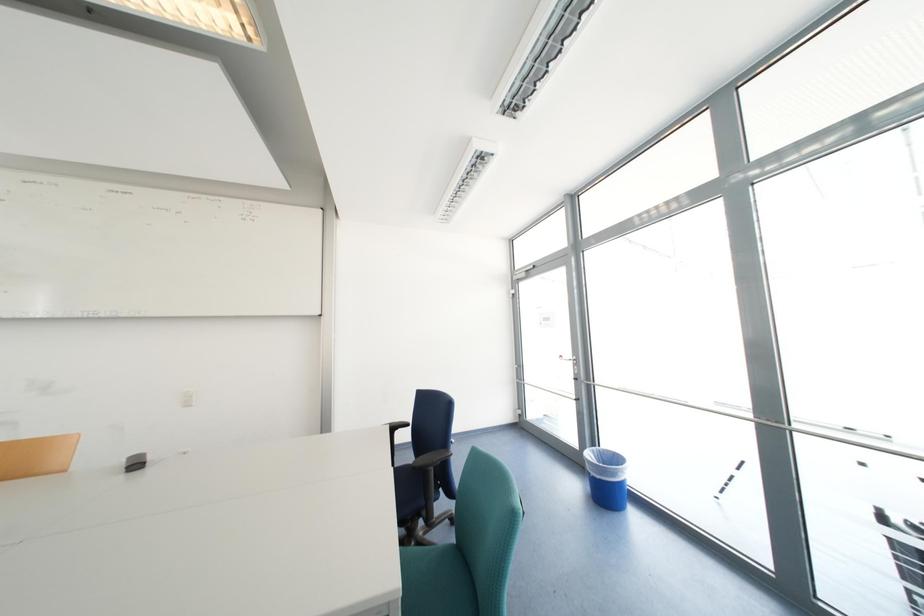
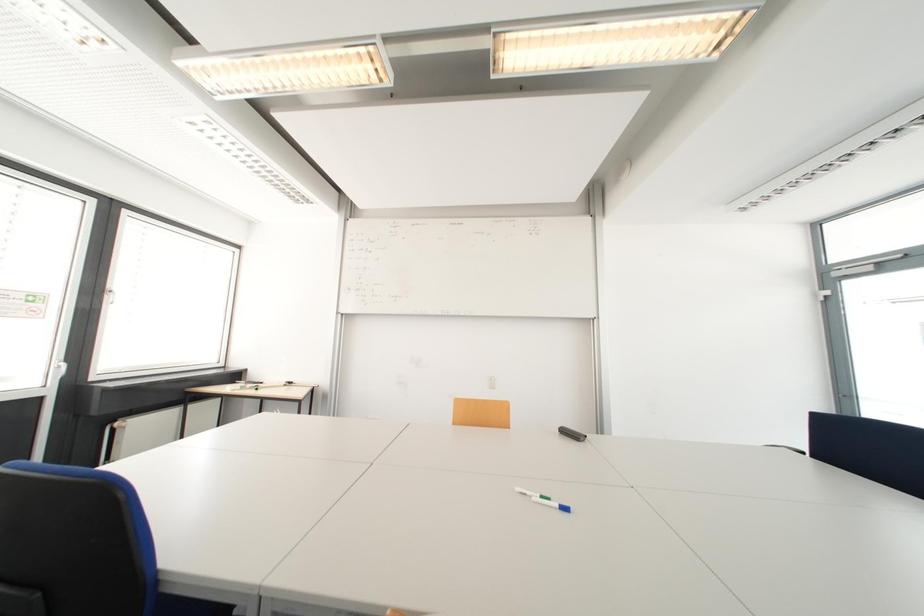
Question: What movement of the cameraman would produce the second image?

Choices:
 (A) Left
 (B) Right
 (C) Forward
 (D) Backward

Answer: (A)